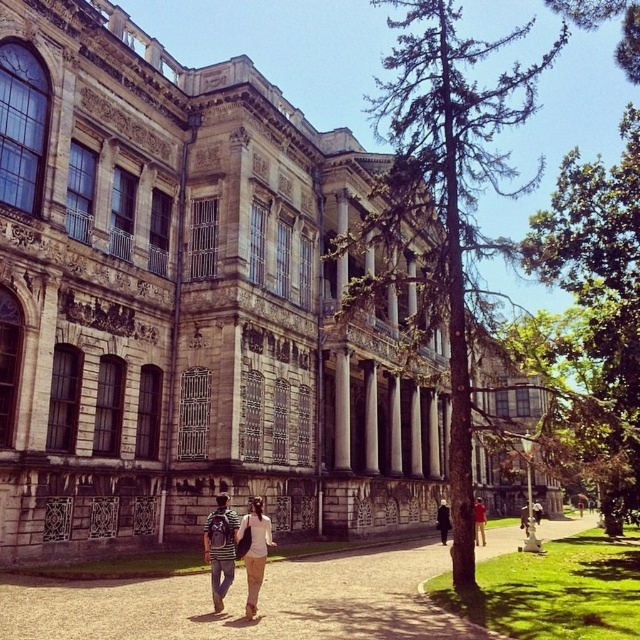
Question: Among these objects, which one is farthest from the camera?

Choices:
 (A) green leafy tree at right
 (B) brown gravel path at center

Answer: (A)

Question: Is green leafy tree at center thinner than brown leather jacket at center?

Choices:
 (A) no
 (B) yes

Answer: (A)

Question: Does green leafy tree at center appear over striped fabric backpack at center?

Choices:
 (A) yes
 (B) no

Answer: (A)

Question: Estimate the real-world distances between objects in this image. Which object is farther from the brown leather jacket at center?

Choices:
 (A) dark brown leather jacket at center
 (B) green leafy tree at right
 (C) striped fabric backpack at center
 (D) striped cotton shirt at center

Answer: (B)

Question: Which object is farther from the camera taking this photo?

Choices:
 (A) striped fabric backpack at center
 (B) striped cotton shirt at center
 (C) brown gravel path at center

Answer: (A)

Question: Can you confirm if green leafy tree at right is thinner than dark brown leather jacket at center?

Choices:
 (A) no
 (B) yes

Answer: (A)